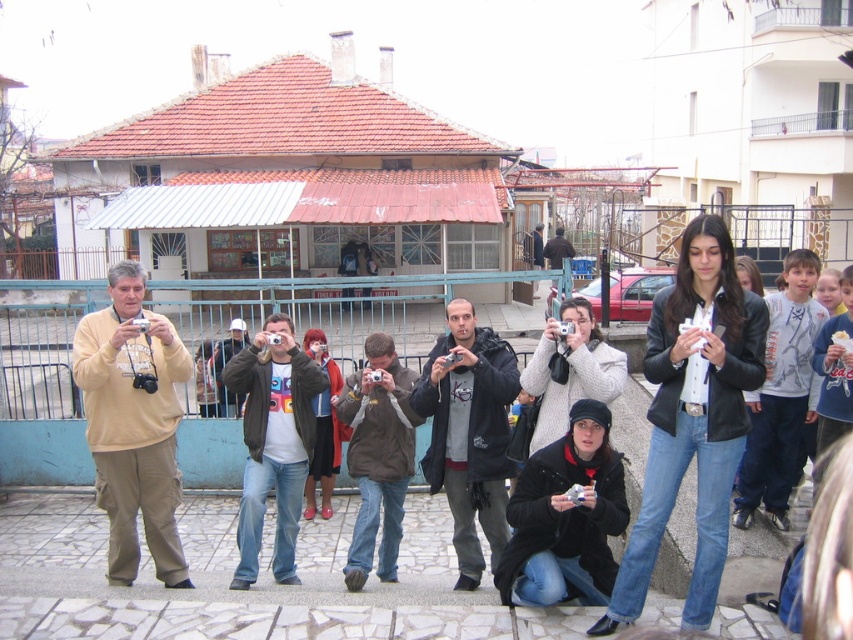
You are a photographer trying to capture a clear shot of the small building with the red tiled roof. There are two people wearing the beige fleece jacket at center and dark gray jacket at center blocking your view. Which jacket should you ask to move so you can see the building better?

The beige fleece jacket at center is in front of the dark gray jacket at center, so you should ask the person wearing the beige fleece jacket at center to move to get a clearer view of the building.